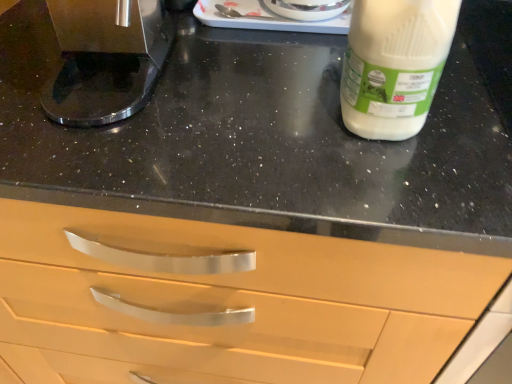
Where is `vacant space to the right of shiny metallic coffee machine at left`? vacant space to the right of shiny metallic coffee machine at left is located at coordinates (262, 80).